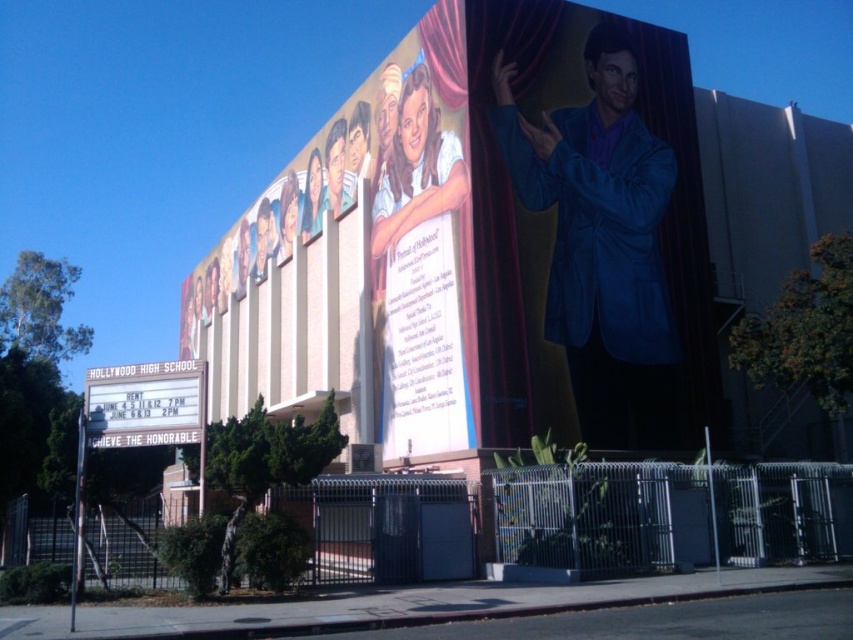
Where is `blue glossy suit at upper right`? blue glossy suit at upper right is located at coordinates (490, 243).

Who is more forward, (312, 392) or (172, 435)?

Point (172, 435)

Find the location of `blue glossy suit at upper right`. blue glossy suit at upper right is located at coordinates (490, 243).

Which is in front, point (463, 328) or point (659, 195)?

Positioned in front is point (463, 328).

Based on the photo, is blue glossy suit at upper right taller than blue velvet suit at right?

Yes.

Does point (616, 214) come closer to viewer compared to point (612, 227)?

No, it is behind (612, 227).

Where is `blue glossy suit at upper right`? The height and width of the screenshot is (640, 853). blue glossy suit at upper right is located at coordinates pyautogui.click(x=490, y=243).

Is blue velvet suit at right positioned at the back of white marquee sign at lower left?

Yes.

Who is higher up, blue velvet suit at right or white marquee sign at lower left?

blue velvet suit at right is above.

Where is `blue velvet suit at right`? The width and height of the screenshot is (853, 640). blue velvet suit at right is located at coordinates (601, 243).